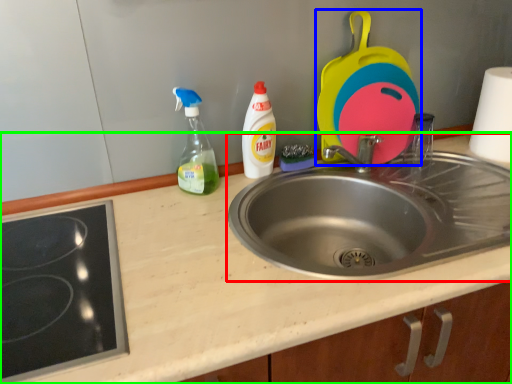
Question: Which object is the closest to the sink (highlighted by a red box)? Choose among these: appliance (highlighted by a blue box) or counter top (highlighted by a green box).

Choices:
 (A) appliance
 (B) counter top

Answer: (B)